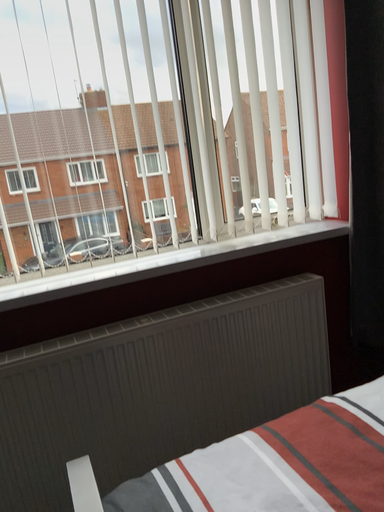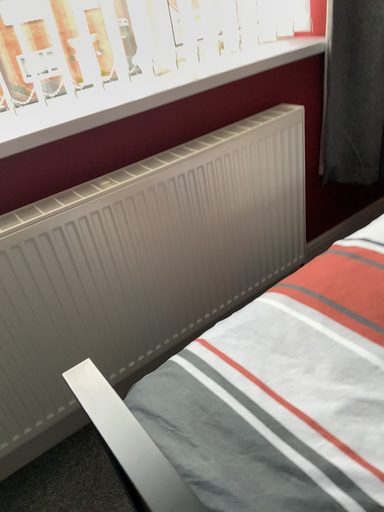
Question: How did the camera likely rotate when shooting the video?

Choices:
 (A) rotated right
 (B) rotated left

Answer: (A)